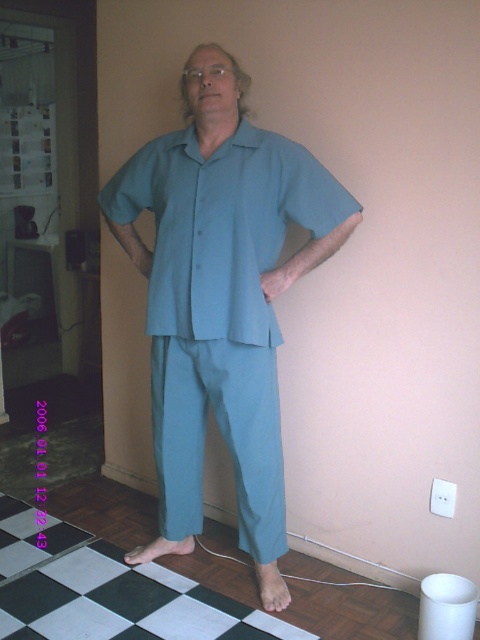
Question: Where is teal cotton pajamas at center located in relation to teal smooth shirt at center in the image?

Choices:
 (A) above
 (B) below

Answer: (B)

Question: In this image, where is teal cotton pajamas at center located relative to teal smooth shirt at center?

Choices:
 (A) right
 (B) left

Answer: (B)

Question: Which point appears closest to the camera in this image?

Choices:
 (A) (184, 188)
 (B) (168, 541)

Answer: (A)

Question: Does teal cotton pajamas at center appear over teal smooth shirt at center?

Choices:
 (A) yes
 (B) no

Answer: (B)

Question: Which point is closer to the camera taking this photo?

Choices:
 (A) (257, 179)
 (B) (243, 195)

Answer: (B)